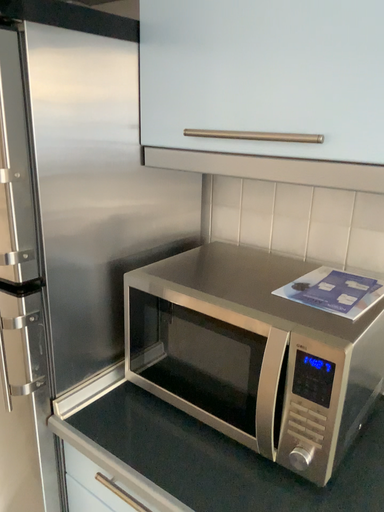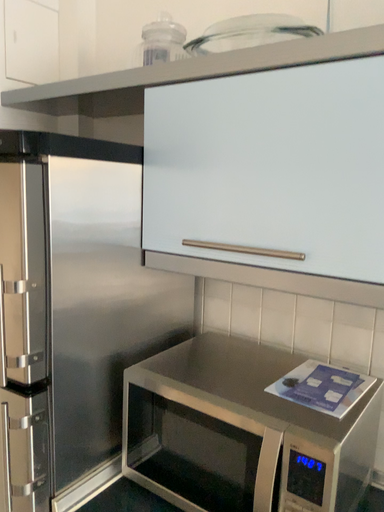
Question: How did the camera likely rotate when shooting the video?

Choices:
 (A) rotated upward
 (B) rotated downward

Answer: (A)